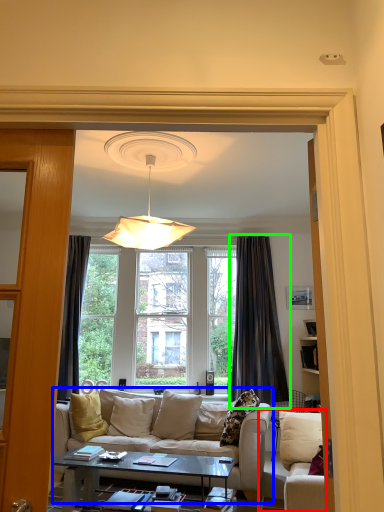
Question: Considering the real-world distances, which object is farthest from studio couch (highlighted by a red box)? studio couch (highlighted by a blue box) or curtain (highlighted by a green box)?

Choices:
 (A) studio couch
 (B) curtain

Answer: (B)